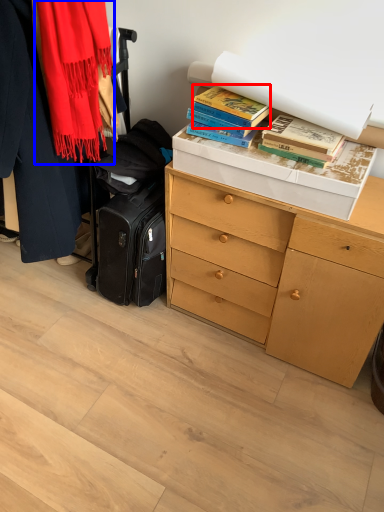
Question: Among these objects, which one is nearest to the camera, book (highlighted by a red box) or scarf (highlighted by a blue box)?

Choices:
 (A) book
 (B) scarf

Answer: (B)